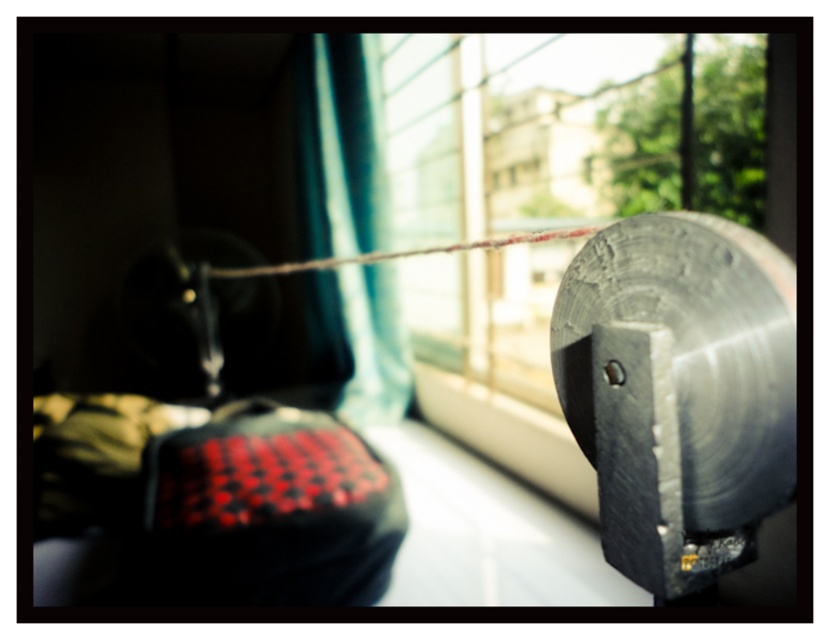
Between point (740, 186) and point (382, 252), which one is positioned in front?

Point (382, 252) is more forward.

Between metallic gray window at upper right and rusty wire at center, which one appears on the right side from the viewer's perspective?

metallic gray window at upper right is more to the right.

What are the coordinates of `metallic gray window at upper right` in the screenshot? It's located at (565, 129).

Which is in front, point (564, 116) or point (391, 408)?

Point (391, 408) is more forward.

I want to click on metallic gray window at upper right, so click(x=565, y=129).

Can you confirm if teal fabric curtain at center is positioned to the right of rusty wire at center?

Incorrect, teal fabric curtain at center is not on the right side of rusty wire at center.

Consider the image. Who is shorter, teal fabric curtain at center or rusty wire at center?

Standing shorter between the two is rusty wire at center.

Image resolution: width=830 pixels, height=640 pixels. What are the coordinates of `teal fabric curtain at center` in the screenshot? It's located at (335, 147).

Image resolution: width=830 pixels, height=640 pixels. In order to click on teal fabric curtain at center in this screenshot , I will do `click(335, 147)`.